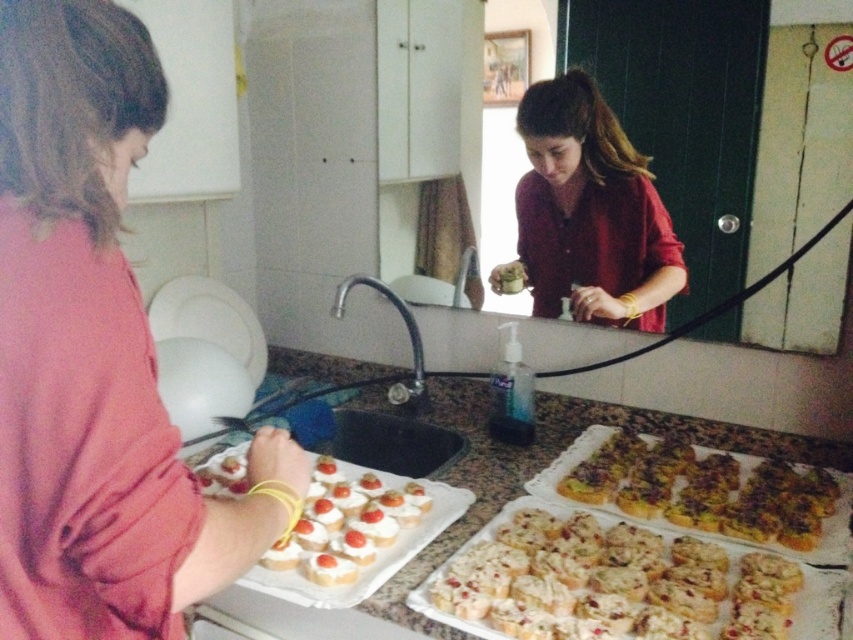
Question: Which of the following is the closest to the observer?

Choices:
 (A) (793, 540)
 (B) (125, 449)
 (C) (583, 176)

Answer: (B)

Question: Which point is closer to the camera?

Choices:
 (A) (573, 563)
 (B) (73, 307)

Answer: (B)

Question: Which point is closer to the camera?

Choices:
 (A) white marble tray at lower left
 (B) matte red blouse at center
 (C) pink fabric shirt at left
 (D) white cream cheese canapés at lower left

Answer: (C)

Question: Is the position of white crumbly at center more distant than that of white marble tray at lower left?

Choices:
 (A) yes
 (B) no

Answer: (B)

Question: Does white crumbly at center appear over white marble tray at lower left?

Choices:
 (A) no
 (B) yes

Answer: (A)

Question: Does pink fabric shirt at left appear on the right side of white marble tray at lower left?

Choices:
 (A) yes
 (B) no

Answer: (B)